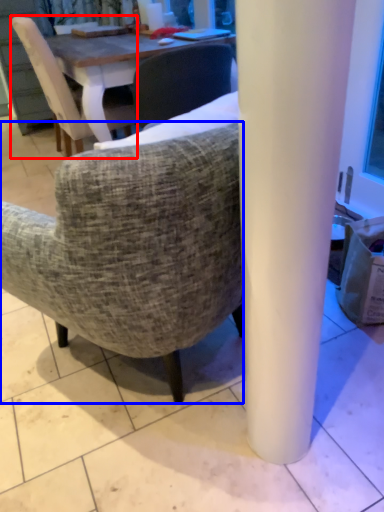
Question: Among these objects, which one is farthest to the camera, chair (highlighted by a red box) or chair (highlighted by a blue box)?

Choices:
 (A) chair
 (B) chair

Answer: (A)